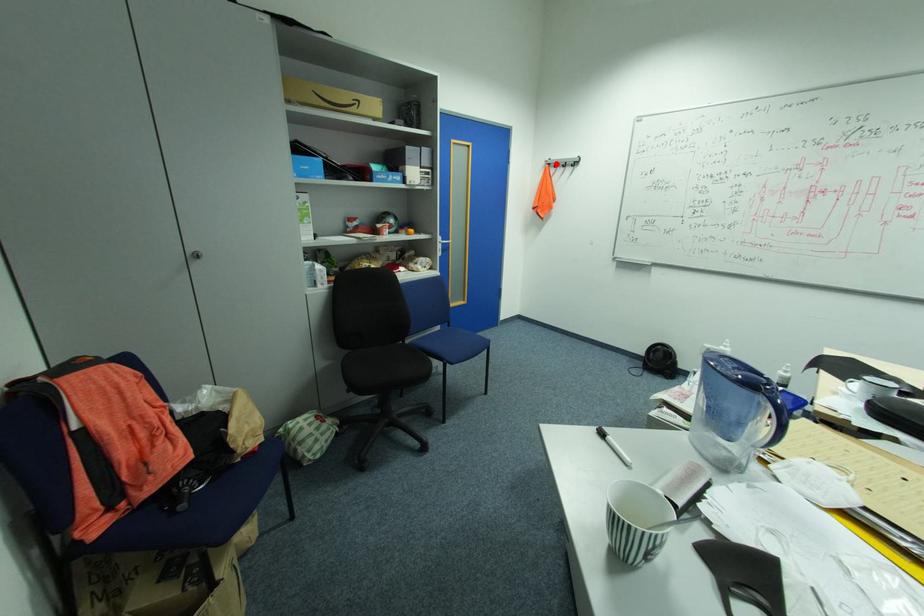
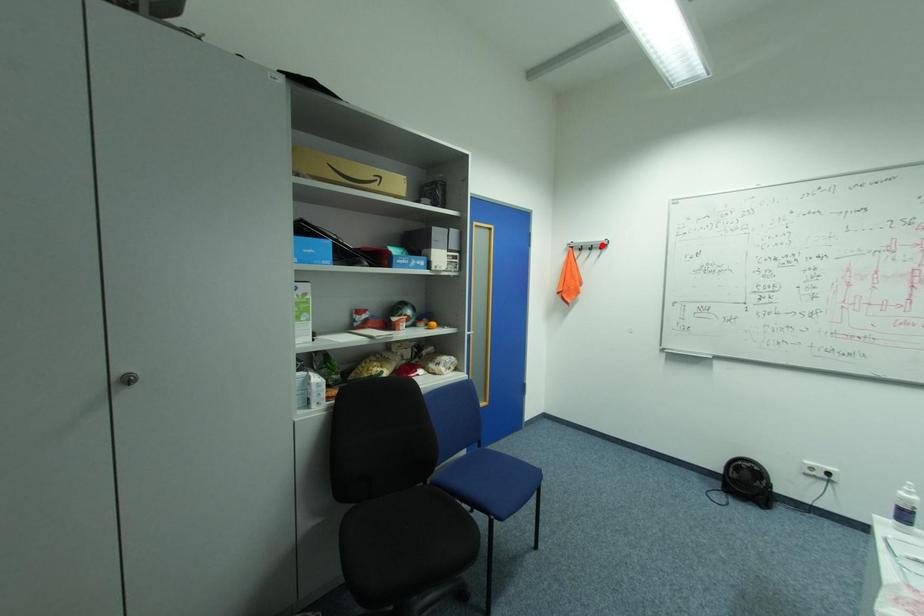
I am providing you with two images of the same scene from different viewpoints. A red point is marked on the first image and another point is marked on the second image. Do the highlighted points in image1 and image2 indicate the same real-world spot?

No